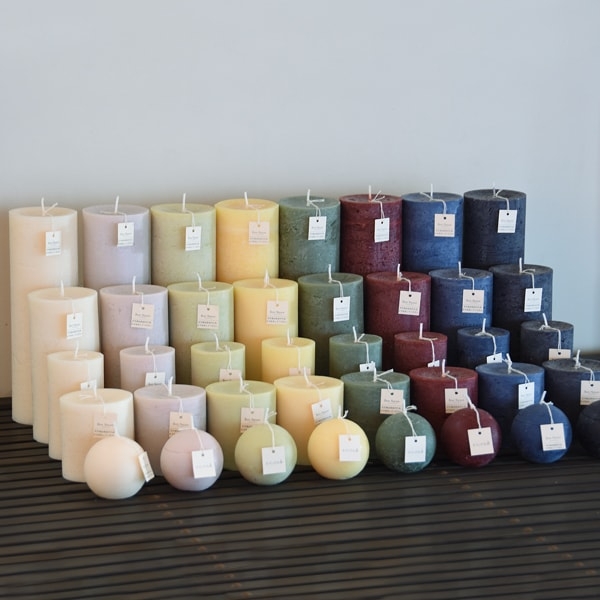
Identify the location of candles in second row from top. (83, 418), (152, 411), (222, 406), (295, 403), (359, 395), (426, 385), (495, 386), (566, 377).